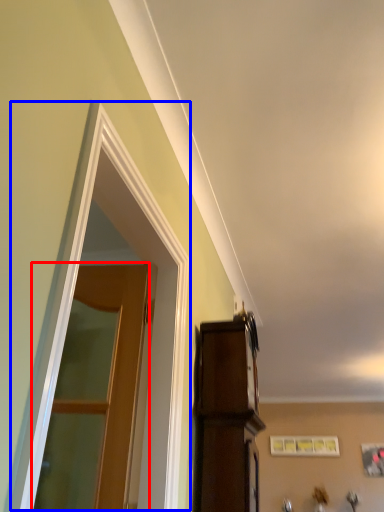
Question: Which object is closer to the camera taking this photo, door (highlighted by a red box) or window (highlighted by a blue box)?

Choices:
 (A) door
 (B) window

Answer: (B)